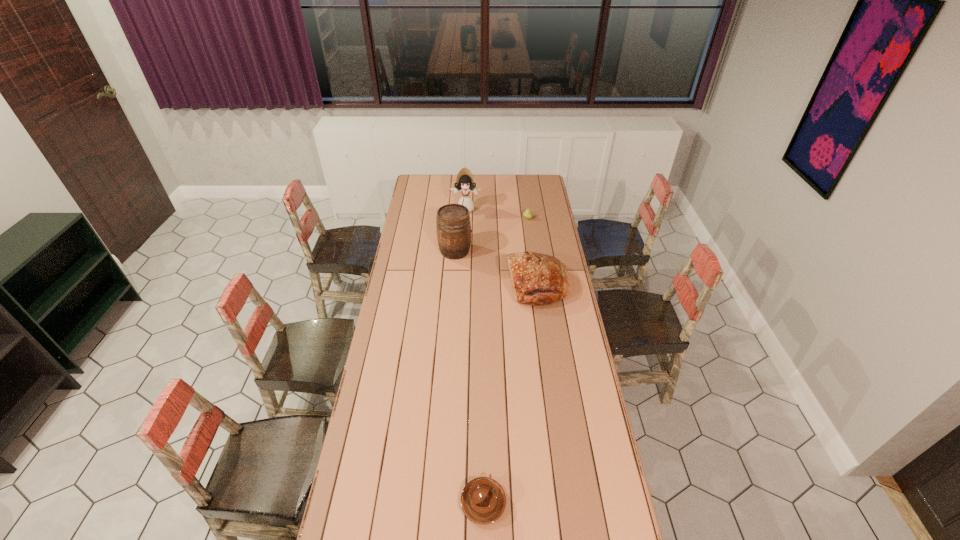
At what (x,y) coordinates should I click in order to perform the action: click on the farthest object. Please return your answer as a coordinate pair (x, y). Image resolution: width=960 pixels, height=540 pixels. Looking at the image, I should click on (465, 183).

Locate an element on the screen. The height and width of the screenshot is (540, 960). cider is located at coordinates (453, 226).

Find the location of a particular element. The image size is (960, 540). the fourth farthest object is located at coordinates (537, 279).

Locate an element on the screen. This screenshot has width=960, height=540. the third tallest object is located at coordinates (537, 279).

The width and height of the screenshot is (960, 540). In order to click on pear in this screenshot , I will do pos(528,214).

Identify the location of the fourth nearest object. (528, 214).

Find the location of a particular element. This screenshot has height=540, width=960. the shortest object is located at coordinates (483, 500).

Locate an element on the screen. This screenshot has height=540, width=960. the nearest object is located at coordinates (483, 500).

Image resolution: width=960 pixels, height=540 pixels. I want to click on free spot located at the front face of the farthest object, so click(466, 226).

Where is `vacant space located 0.080m on the side of the cider near the bung hole`? The width and height of the screenshot is (960, 540). vacant space located 0.080m on the side of the cider near the bung hole is located at coordinates (487, 251).